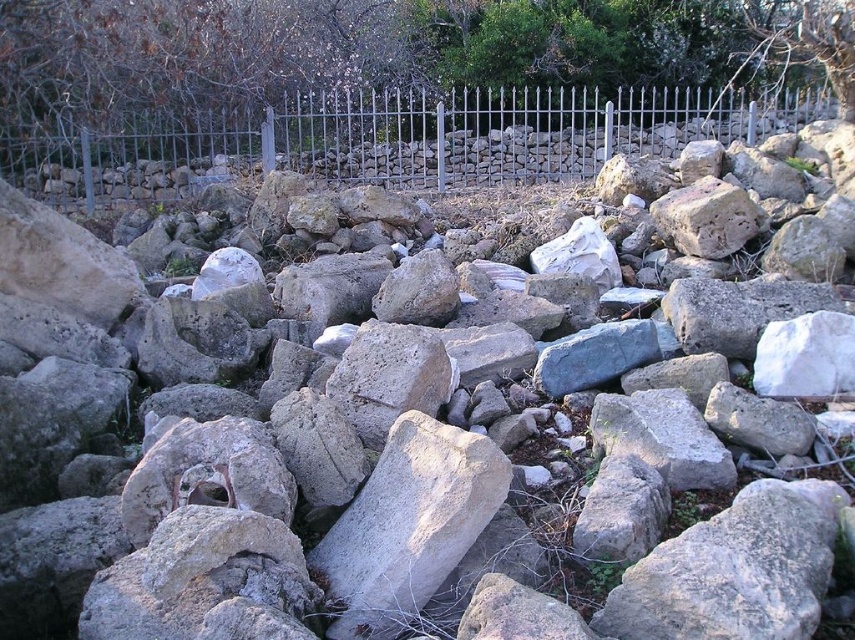
You are standing in front of the large rock pile and notice a green leafy tree at upper center and a metallic fence at upper center. Which object is positioned more to the right side?

The green leafy tree at upper center is positioned more to the right side than the metallic fence at upper center.

You are standing in front of the rock pile and want to place a small flag at both point (310, 16) and point (199, 163). Which point is closer to you when you are facing the rock pile?

Point (199, 163) is closer to you because it is less further to the camera than point (310, 16).